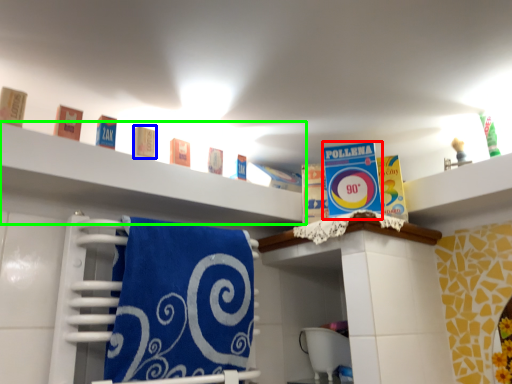
Question: Which is nearer to the product (highlighted by a red box)? product (highlighted by a blue box) or shelf (highlighted by a green box).

Choices:
 (A) product
 (B) shelf

Answer: (B)